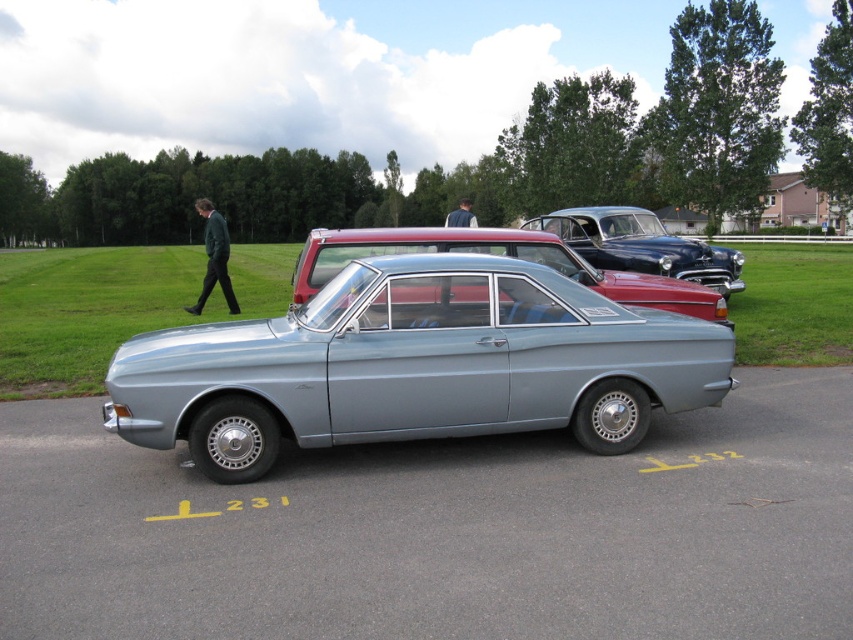
Question: Estimate the real-world distances between objects in this image. Which object is farther from the shiny blue car at center?

Choices:
 (A) metallic gray car at center
 (B) green wool coat at upper left

Answer: (B)

Question: From the image, what is the correct spatial relationship of satin silver car at center in relation to green wool coat at upper left?

Choices:
 (A) above
 (B) below

Answer: (B)

Question: Is metallic gray car at center below shiny blue car at center?

Choices:
 (A) yes
 (B) no

Answer: (A)

Question: Among these points, which one is farthest from the camera?

Choices:
 (A) (199, 202)
 (B) (689, 269)

Answer: (A)

Question: Can you confirm if shiny blue car at center is positioned to the right of green wool coat at upper left?

Choices:
 (A) yes
 (B) no

Answer: (A)

Question: Which object appears closest to the camera in this image?

Choices:
 (A) shiny blue car at center
 (B) metallic gray car at center
 (C) metallic silver car at center

Answer: (B)